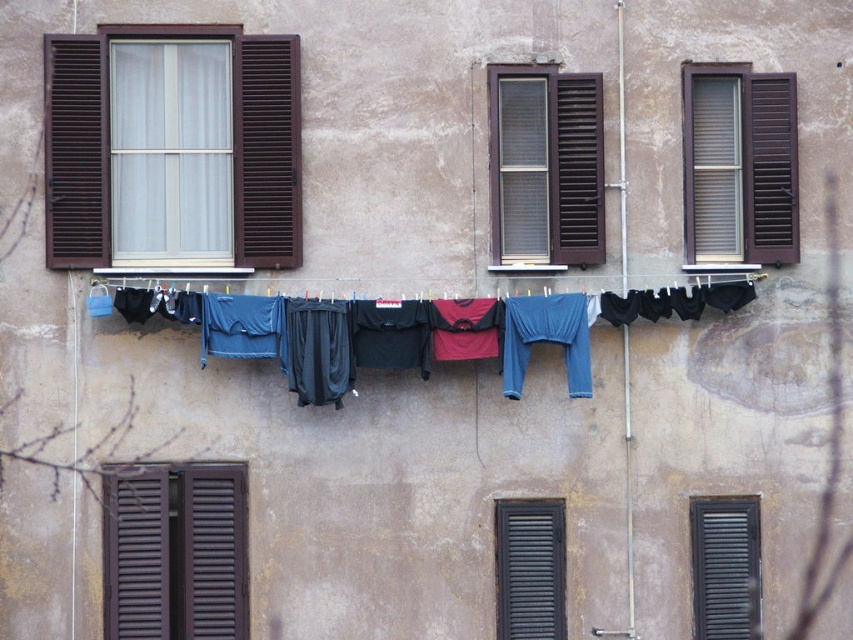
You are standing in front of the building and want to take a photo. There are two points marked on the wall at coordinates point (x=207, y=516) and point (x=601, y=211). Which point will appear larger in your photo?

Point (x=207, y=516) is closer to the camera than point (x=601, y=211), so it will appear larger in the photo.